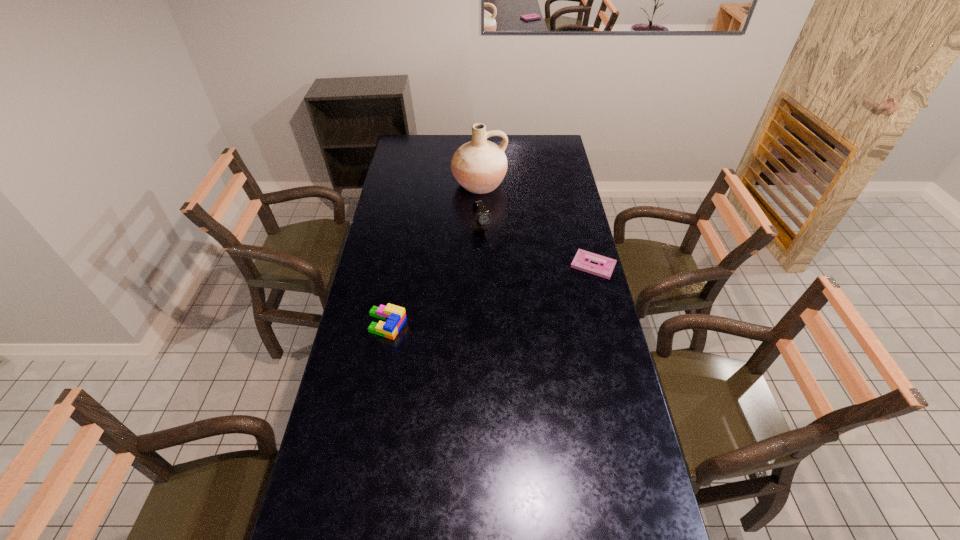
The width and height of the screenshot is (960, 540). What are the coordinates of `free space between the leftmost object and the third farthest object` in the screenshot? It's located at (491, 295).

Image resolution: width=960 pixels, height=540 pixels. I want to click on the third closest object to the watch, so click(395, 316).

Locate an element on the screen. This screenshot has width=960, height=540. the closest object to the shortest object is located at coordinates (482, 217).

Find the location of a particular element. This screenshot has height=540, width=960. vacant space that satisfies the following two spatial constraints: 1. on the front side of the shortest object; 2. on the left side of the watch is located at coordinates (482, 265).

Locate an element on the screen. The width and height of the screenshot is (960, 540). free location that satisfies the following two spatial constraints: 1. on the back side of the Lego; 2. on the right side of the second nearest object is located at coordinates (397, 265).

Find the location of a particular element. The height and width of the screenshot is (540, 960). free space that satisfies the following two spatial constraints: 1. on the back side of the rightmost object; 2. on the right side of the leftmost object is located at coordinates (397, 265).

Image resolution: width=960 pixels, height=540 pixels. I want to click on vacant area in the image that satisfies the following two spatial constraints: 1. on the front side of the pottery; 2. on the left side of the shortest object, so click(x=479, y=265).